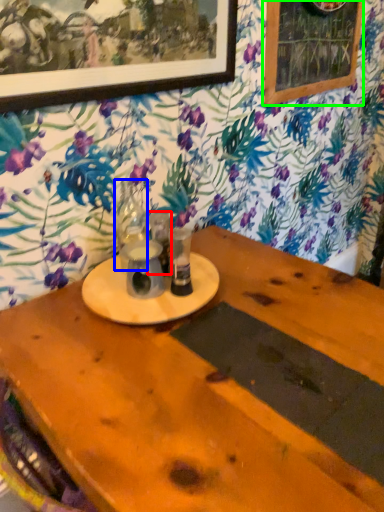
Question: Which object is the farthest from tableware (highlighted by a red box)? Choose among these: tableware (highlighted by a blue box) or bulletin board (highlighted by a green box).

Choices:
 (A) tableware
 (B) bulletin board

Answer: (B)